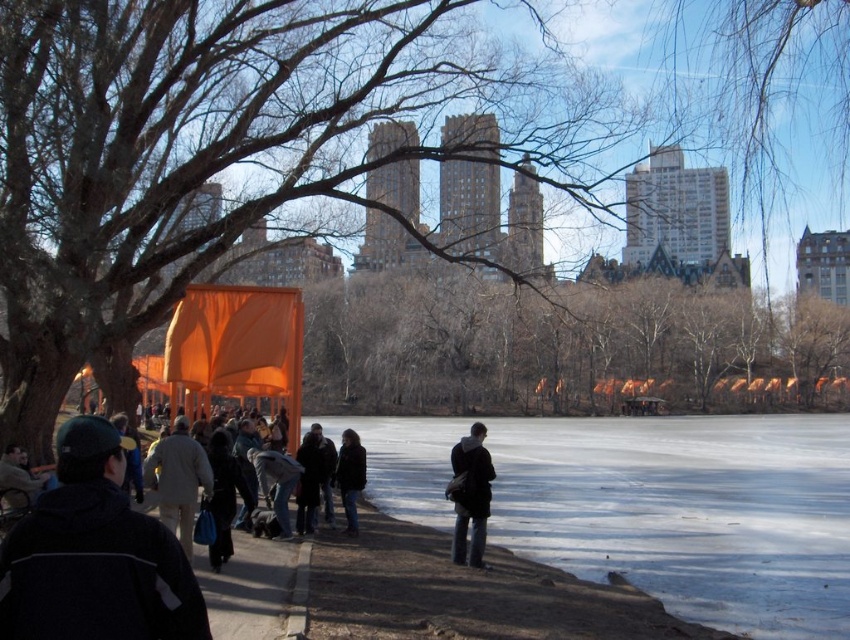
You are a visitor at the park and want to take a photo of the orange fabric at center and the light beige coat at lower left. Which object should you frame first in your camera to ensure both are in the same shot?

You should frame the light beige coat at lower left first because the orange fabric at center is positioned on the right side of it, so by starting with the coat, you can adjust the camera to include both objects in the frame.

You are a photographer trying to capture the smooth orange fabric at center and the dark brown leather jacket at center in the same frame. Which object should you focus on first to ensure both are in the shot?

The smooth orange fabric at center is above the dark brown leather jacket at center, so you should focus on the dark brown leather jacket at center first to ensure both are in the shot.